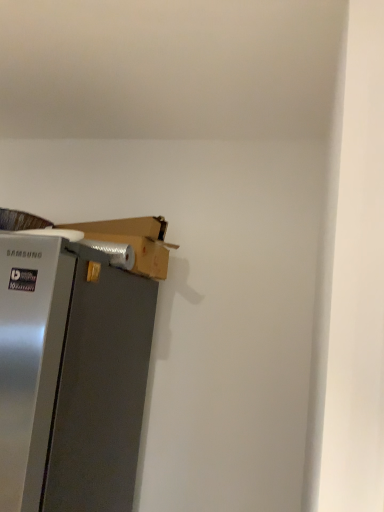
Describe the element at coordinates (70, 376) in the screenshot. The image size is (384, 512). I see `satin silver refrigerator at left` at that location.

This screenshot has height=512, width=384. Find the location of `satin silver refrigerator at left`. satin silver refrigerator at left is located at coordinates (70, 376).

This screenshot has height=512, width=384. What are the coordinates of `satin silver refrigerator at left` in the screenshot? It's located at (70, 376).